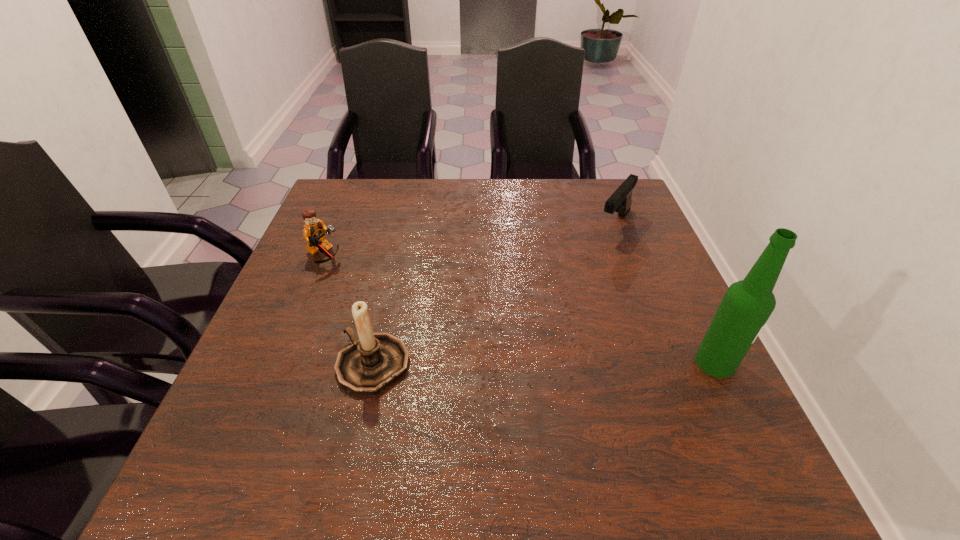
In the image, there is a desktop. Where is `vacant space at the left edge`? The width and height of the screenshot is (960, 540). vacant space at the left edge is located at coordinates [318, 266].

You are a GUI agent. You are given a task and a screenshot of the screen. Output one action in this format:
    pyautogui.click(x=<x>, y=<y>)
    Task: Click on the vacant space at the right edge of the desktop
    This screenshot has height=540, width=960.
    Given the screenshot: What is the action you would take?
    pyautogui.click(x=643, y=274)

This screenshot has height=540, width=960. Identify the location of free space at the far right corner of the desktop. (584, 181).

Find the location of a particular element. The width and height of the screenshot is (960, 540). vacant space that is in between the tallest object and the pistol is located at coordinates (665, 293).

Where is `vacant region between the Lego and the beer bottle`? vacant region between the Lego and the beer bottle is located at coordinates (520, 309).

This screenshot has height=540, width=960. I want to click on free space between the third shortest object and the Lego, so click(349, 310).

Where is `vacant area that lies between the pistol and the leftmost object`? The image size is (960, 540). vacant area that lies between the pistol and the leftmost object is located at coordinates (469, 240).

Identify the location of unoccupied area between the third shortest object and the pistol. (494, 294).

Image resolution: width=960 pixels, height=540 pixels. I want to click on free spot between the leftmost object and the pistol, so click(x=469, y=240).

Identify the location of vacant region between the tallest object and the second tallest object. The height and width of the screenshot is (540, 960). (544, 363).